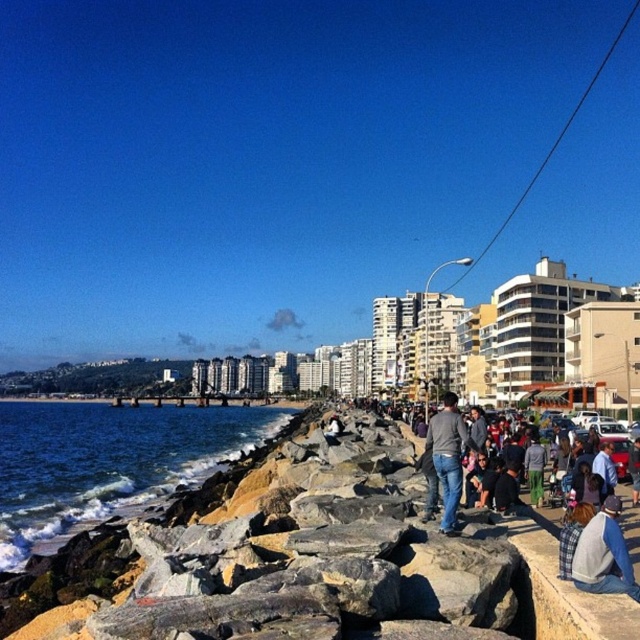
Question: Which object is positioned closest to the denim jacket at lower right?

Choices:
 (A) plaid fabric jacket at lower right
 (B) jeans at center

Answer: (A)

Question: Which object is the farthest from the denim jacket at lower right?

Choices:
 (A) jeans at center
 (B) blue smooth water at lower left

Answer: (B)

Question: Which of the following is the closest to the observer?

Choices:
 (A) (612, 506)
 (B) (448, 467)
 (C) (630, 451)
 (D) (8, 548)

Answer: (A)

Question: Can you confirm if blue smooth water at lower left is positioned below jeans at center?

Choices:
 (A) no
 (B) yes

Answer: (B)

Question: In this image, where is blue smooth water at lower left located relative to denim jacket at lower right?

Choices:
 (A) below
 (B) above

Answer: (A)

Question: Does blue smooth water at lower left have a greater width compared to plaid fabric jacket at lower right?

Choices:
 (A) no
 (B) yes

Answer: (B)